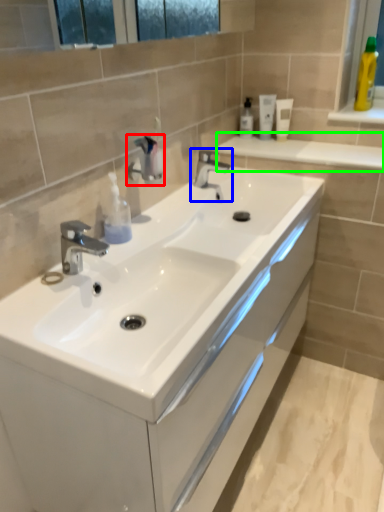
Question: Which object is the closest to the plumbing fixture (highlighted by a red box)? Choose among these: tap (highlighted by a blue box) or balustrade (highlighted by a green box).

Choices:
 (A) tap
 (B) balustrade

Answer: (A)